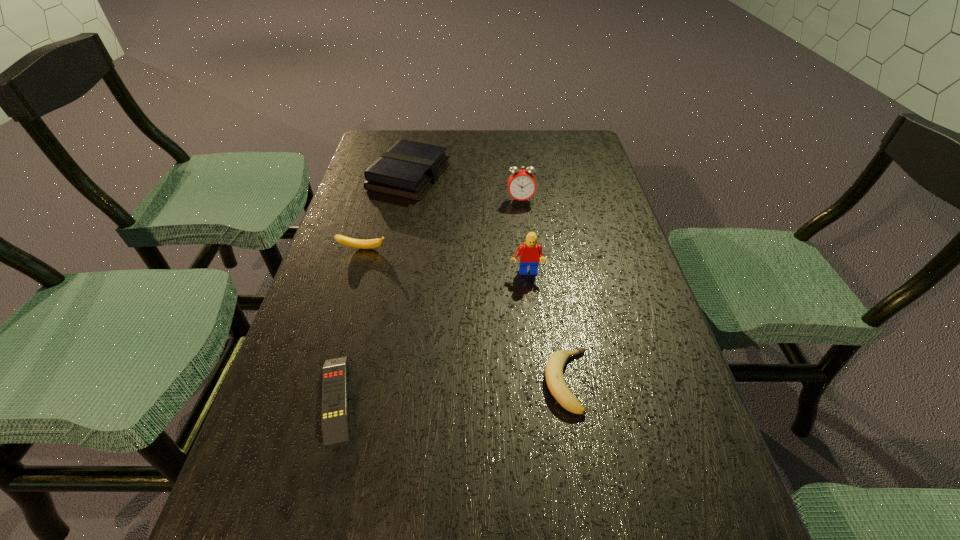
Find the location of a particular element. Image resolution: width=960 pixels, height=540 pixels. vacant point located between the fourth tallest object and the shorter banana is located at coordinates (465, 315).

What are the coordinates of `vacant space that's between the third nearest object and the second shortest object` in the screenshot? It's located at (547, 328).

Identify the location of vacant point located between the third farthest object and the alarm clock. The image size is (960, 540). (442, 225).

The width and height of the screenshot is (960, 540). Identify the location of the closest object to the fourth shortest object. (521, 184).

You are a GUI agent. You are given a task and a screenshot of the screen. Output one action in this format:
    pyautogui.click(x=<x>, y=<y>)
    Task: Click on the third closest object to the shortest object
    
    Given the screenshot: What is the action you would take?
    pyautogui.click(x=530, y=253)

This screenshot has height=540, width=960. Find the location of `vacant region that satisfies the following two spatial constraints: 1. on the front-facing side of the shorter banana; 2. on the left side of the alarm clock`. vacant region that satisfies the following two spatial constraints: 1. on the front-facing side of the shorter banana; 2. on the left side of the alarm clock is located at coordinates (541, 381).

Where is `vacant space that satisfies the following two spatial constraints: 1. on the front-facing side of the nearer banana; 2. on the left side of the alarm clock`? The image size is (960, 540). vacant space that satisfies the following two spatial constraints: 1. on the front-facing side of the nearer banana; 2. on the left side of the alarm clock is located at coordinates (541, 381).

The height and width of the screenshot is (540, 960). I want to click on vacant space that satisfies the following two spatial constraints: 1. at the stem of the left banana; 2. on the right side of the shortest object, so click(319, 397).

Where is `free space that satisfies the following two spatial constraints: 1. on the front-facing side of the alarm clock; 2. on the right side of the nearer banana`? The image size is (960, 540). free space that satisfies the following two spatial constraints: 1. on the front-facing side of the alarm clock; 2. on the right side of the nearer banana is located at coordinates (541, 381).